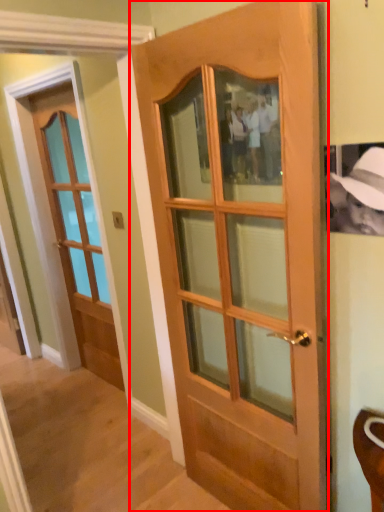
Question: From the image's perspective, what is the correct spatial positioning of door (annotated by the red box) in reference to door?

Choices:
 (A) below
 (B) above

Answer: (A)